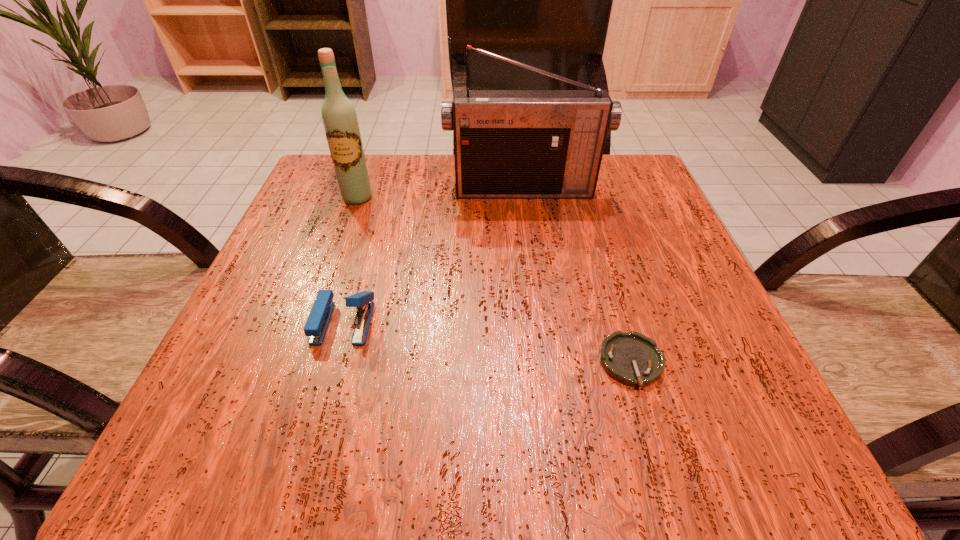
Where is `wine bottle that is positioned at the left edge`? The height and width of the screenshot is (540, 960). wine bottle that is positioned at the left edge is located at coordinates (340, 121).

Locate an element on the screen. stapler at the left edge is located at coordinates click(x=316, y=325).

Where is `radio receiver at the right edge`? radio receiver at the right edge is located at coordinates (508, 144).

Find the location of a particular element. Image resolution: width=960 pixels, height=540 pixels. ashtray located in the right edge section of the desktop is located at coordinates (633, 359).

Identify the location of object positioned at the far left corner. This screenshot has height=540, width=960. (340, 121).

This screenshot has height=540, width=960. Find the location of `object positioned at the far right corner`. object positioned at the far right corner is located at coordinates (508, 144).

Identify the location of free space at the far edge of the desktop. Image resolution: width=960 pixels, height=540 pixels. (408, 179).

Where is `vacant space at the near edge of the desktop`? vacant space at the near edge of the desktop is located at coordinates (590, 447).

Where is `vacant area at the left edge`? Image resolution: width=960 pixels, height=540 pixels. vacant area at the left edge is located at coordinates (303, 223).

What are the coordinates of `vacant region at the right edge` in the screenshot? It's located at (672, 340).